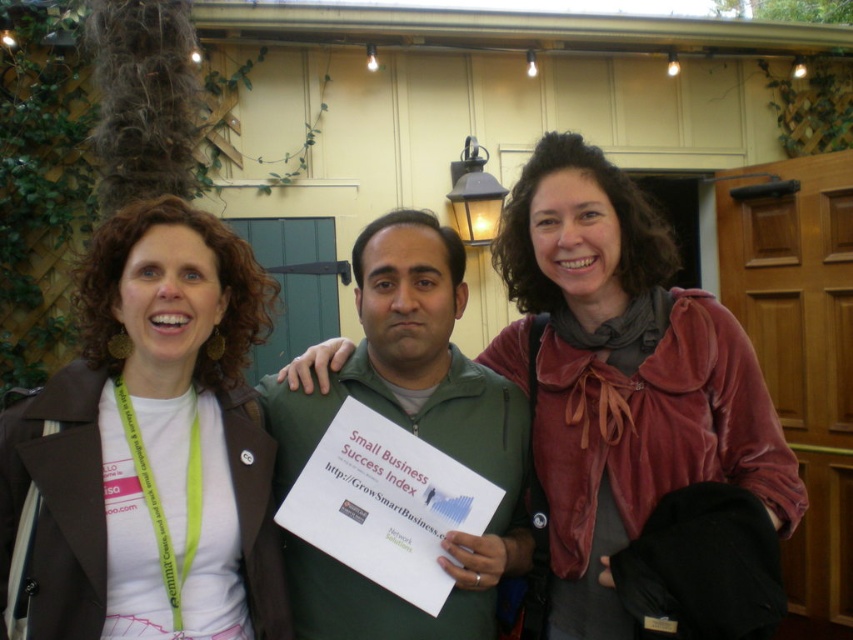
Does point (230, 314) lie behind point (727, 326)?

Yes.

Describe the element at coordinates (151, 444) in the screenshot. I see `matte brown jacket at left` at that location.

The image size is (853, 640). I want to click on matte brown jacket at left, so click(151, 444).

Is matte brown jacket at left bigger than green matte jacket at center?

Yes, matte brown jacket at left is bigger than green matte jacket at center.

Who is more forward, (x=216, y=480) or (x=396, y=344)?

Positioned in front is point (x=216, y=480).

I want to click on matte brown jacket at left, so click(151, 444).

This screenshot has height=640, width=853. What are the coordinates of `matte brown jacket at left` in the screenshot? It's located at (151, 444).

Does velvet red scarf at center appear on the left side of green matte jacket at center?

Incorrect, velvet red scarf at center is not on the left side of green matte jacket at center.

Based on the photo, which is more to the right, velvet red scarf at center or green matte jacket at center?

From the viewer's perspective, velvet red scarf at center appears more on the right side.

Find the location of a particular element. velvet red scarf at center is located at coordinates (621, 378).